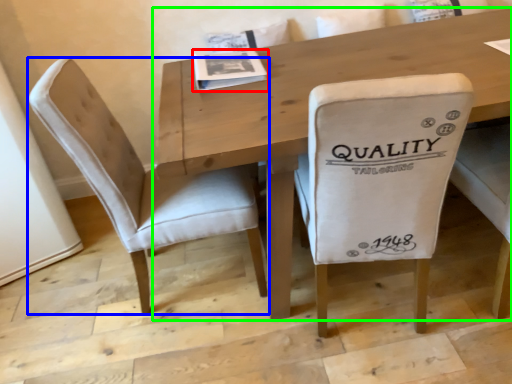
Question: Estimate the real-world distances between objects in this image. Which object is closer to magazine (highlighted by a red box), chair (highlighted by a blue box) or table (highlighted by a green box)?

Choices:
 (A) chair
 (B) table

Answer: (B)